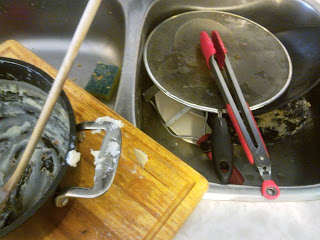
You are a GUI agent. You are given a task and a screenshot of the screen. Output one action in this format:
    pyautogui.click(x=<x>, y=<y>)
    Task: Click on the sink divider
    
    Given the screenshot: What is the action you would take?
    pyautogui.click(x=129, y=59)